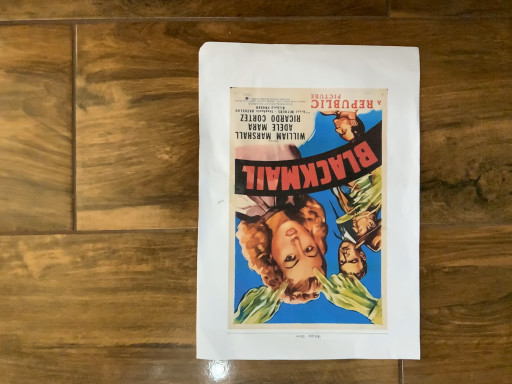
This screenshot has width=512, height=384. In order to click on free space above vibrant paper poster at center (from a real-world perspective) in this screenshot , I will do `click(313, 196)`.